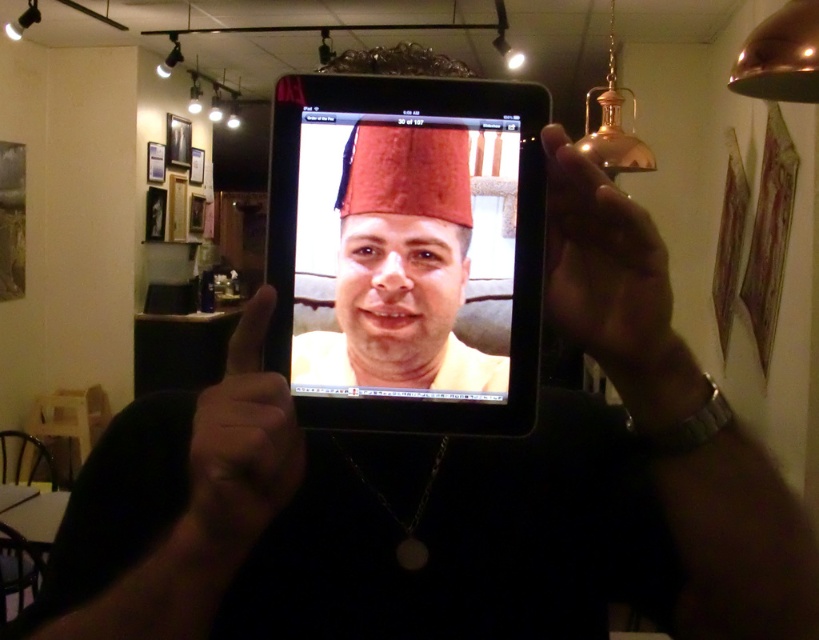
Question: Which is nearer to the matte black hand at center?

Choices:
 (A) matte black tablet at center
 (B) gold metallic hand at upper right

Answer: (A)

Question: Is matte black tablet at center in front of matte black hand at center?

Choices:
 (A) yes
 (B) no

Answer: (B)

Question: From the image, what is the correct spatial relationship of matte black tablet at center in relation to gold metallic hand at upper right?

Choices:
 (A) right
 (B) left

Answer: (B)

Question: Which object appears closest to the camera in this image?

Choices:
 (A) matte black tablet at center
 (B) gold metallic hand at upper right

Answer: (B)

Question: Does matte black tablet at center lie in front of gold metallic hand at upper right?

Choices:
 (A) no
 (B) yes

Answer: (A)

Question: Based on their relative distances, which object is farther from the gold metallic hand at upper right?

Choices:
 (A) matte black tablet at center
 (B) matte black hand at center

Answer: (B)